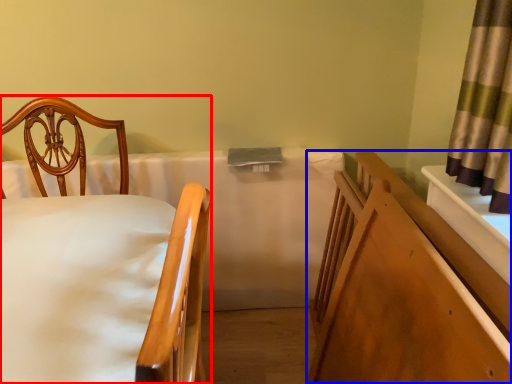
Question: Which object is further to the camera taking this photo, chair (highlighted by a red box) or bed frame (highlighted by a blue box)?

Choices:
 (A) chair
 (B) bed frame

Answer: (B)